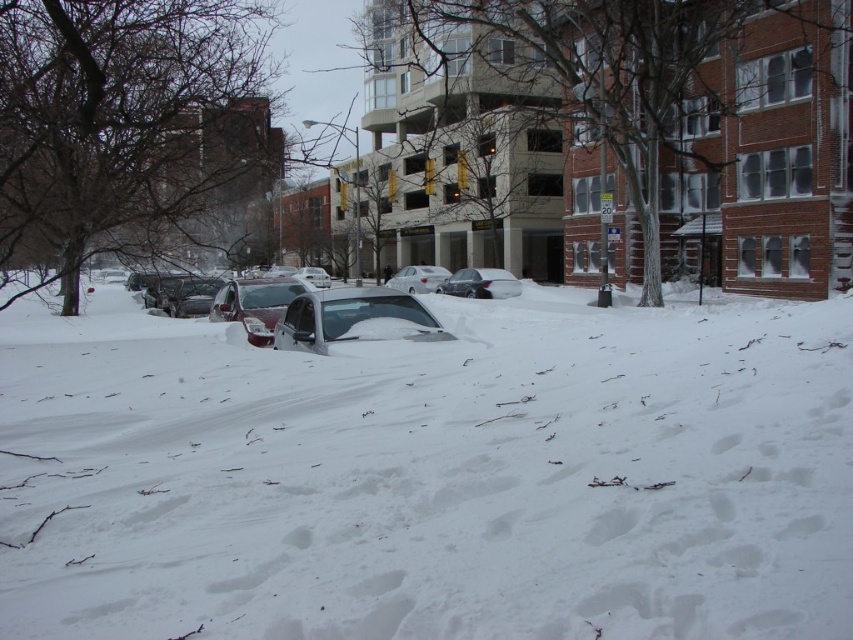
Does white matte car at center appear on the right side of metallic silver sedan at center?

No, white matte car at center is not to the right of metallic silver sedan at center.

Describe the element at coordinates (354, 320) in the screenshot. I see `white matte car at center` at that location.

Does point (384, 337) lie in front of point (445, 280)?

Yes, it is.

The image size is (853, 640). Identify the location of white matte car at center. (354, 320).

Is sleek silver sedan at center in front of white glossy sedan at center?

Yes, it is.

Is the position of sleek silver sedan at center more distant than that of white glossy sedan at center?

No, sleek silver sedan at center is closer to the viewer.

Does point (323, 328) come farther from viewer compared to point (399, 272)?

No, it is in front of (399, 272).

Find the location of a particular element. The image size is (853, 640). sleek silver sedan at center is located at coordinates (347, 317).

Does metallic silver sedan at center appear on the left side of white glossy sedan at center?

In fact, metallic silver sedan at center is to the right of white glossy sedan at center.

Consider the image. Does metallic silver sedan at center have a greater width compared to white glossy sedan at center?

Yes, metallic silver sedan at center is wider than white glossy sedan at center.

Describe the element at coordinates (480, 284) in the screenshot. I see `metallic silver sedan at center` at that location.

Find the location of a particular element. This screenshot has width=853, height=640. metallic silver sedan at center is located at coordinates (480, 284).